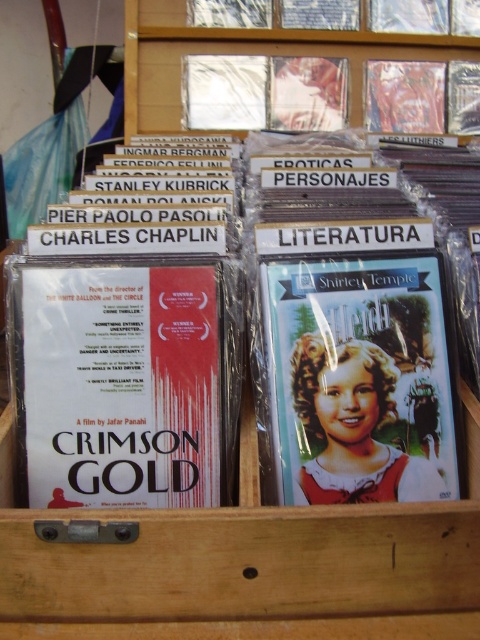
Can you confirm if white matte dvd case at center is thinner than matte plastic dvd at center?

In fact, white matte dvd case at center might be wider than matte plastic dvd at center.

Is white matte dvd case at center bigger than matte plastic dvd at center?

Incorrect, white matte dvd case at center is not larger than matte plastic dvd at center.

Measure the distance between point (x=120, y=374) and camera.

A distance of 34.33 inches exists between point (x=120, y=374) and camera.

Image resolution: width=480 pixels, height=640 pixels. I want to click on white matte dvd case at center, so 124,381.